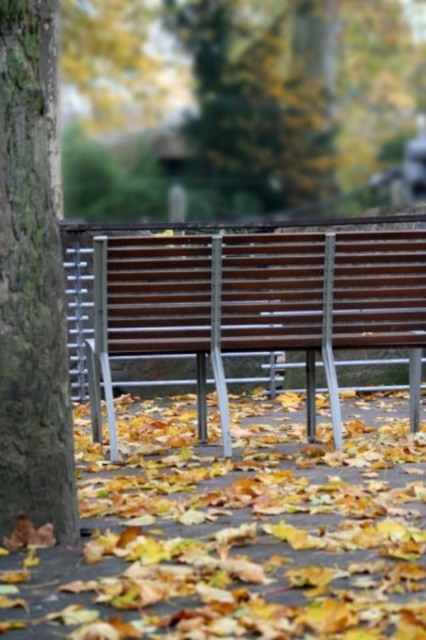
Question: Which of these objects is positioned closest to the yellow leaf litter at lower center?

Choices:
 (A) wooden bench at center
 (B) smooth bark tree at left

Answer: (A)

Question: Can you confirm if wooden bench at center is smaller than smooth bark tree at left?

Choices:
 (A) no
 (B) yes

Answer: (A)

Question: Which point appears closest to the camera in this image?

Choices:
 (A) (6, 429)
 (B) (95, 330)

Answer: (A)

Question: Is yellow leaf litter at lower center thinner than smooth bark tree at left?

Choices:
 (A) yes
 (B) no

Answer: (B)

Question: Is yellow leaf litter at lower center thinner than smooth bark tree at left?

Choices:
 (A) no
 (B) yes

Answer: (A)

Question: Which point is farther to the camera?

Choices:
 (A) (66, 637)
 (B) (46, 326)

Answer: (B)